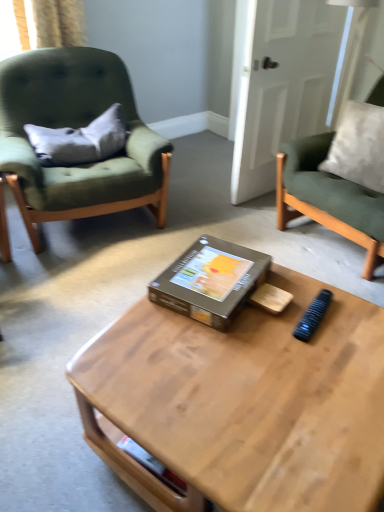
Locate an element on the screen. This screenshot has height=512, width=384. free spot in front of black plastic remote control at center is located at coordinates (330, 357).